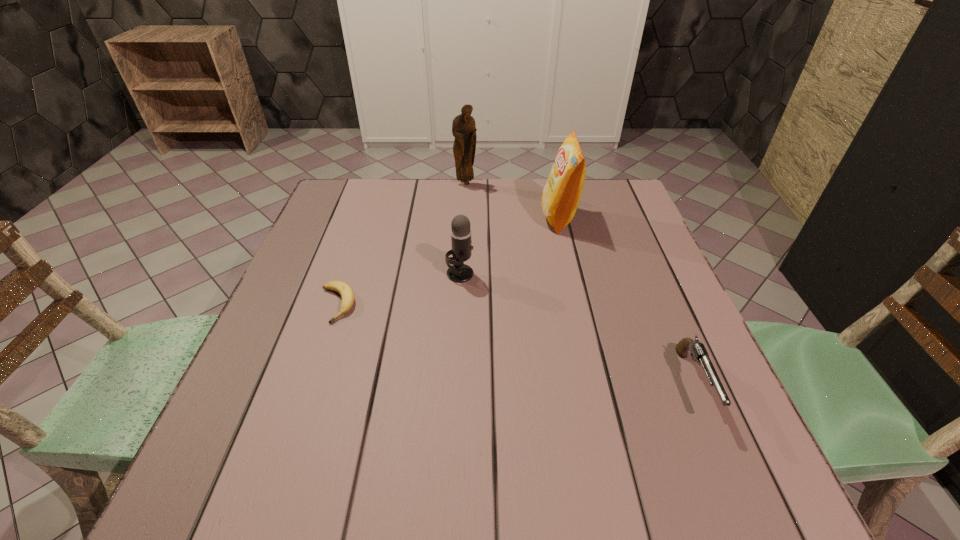
Identify the location of free space located 0.110m on the front-facing side of the crisp (potato chip). This screenshot has width=960, height=540. (502, 218).

In order to click on vacant region located on the front-facing side of the crisp (potato chip) in this screenshot , I will do `click(432, 218)`.

Locate an element on the screen. This screenshot has height=540, width=960. free space located 0.390m on the front-facing side of the crisp (potato chip) is located at coordinates (403, 218).

Locate an element on the screen. This screenshot has width=960, height=540. free space located 0.290m on the front of the third tallest object is located at coordinates (454, 388).

In order to click on vacant space located 0.050m aiming along the barrel of the gun in this screenshot , I will do `click(725, 455)`.

Locate an element on the screen. The height and width of the screenshot is (540, 960). free spot located 0.300m on the right of the shortest object is located at coordinates (489, 305).

Where is `figurine present at the far edge`? The height and width of the screenshot is (540, 960). figurine present at the far edge is located at coordinates (464, 129).

Find the location of a particular element. crisp (potato chip) that is at the far edge is located at coordinates (560, 198).

Find the location of a particular element. This screenshot has height=540, width=960. object present at the left edge is located at coordinates (347, 295).

Where is `object that is at the right edge`? object that is at the right edge is located at coordinates (698, 351).